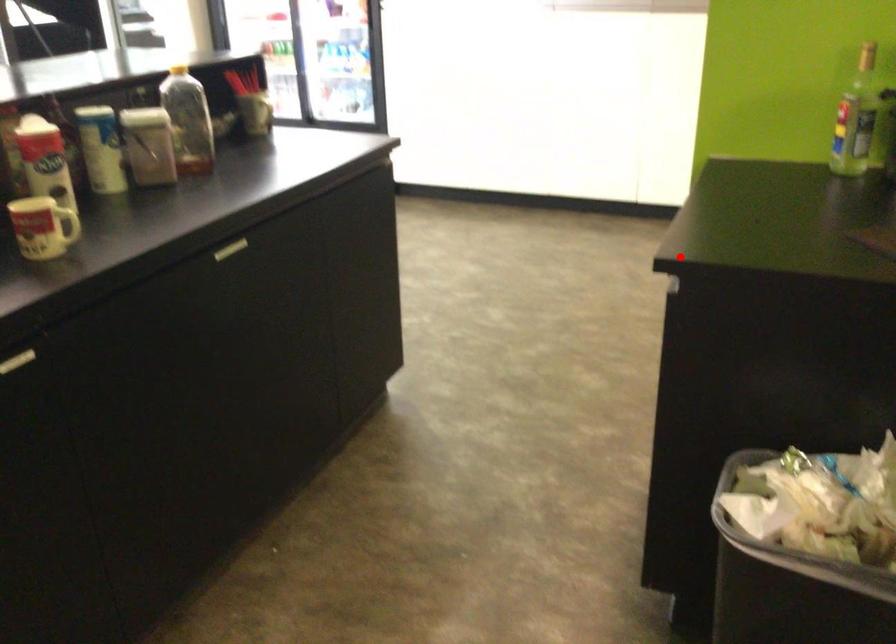
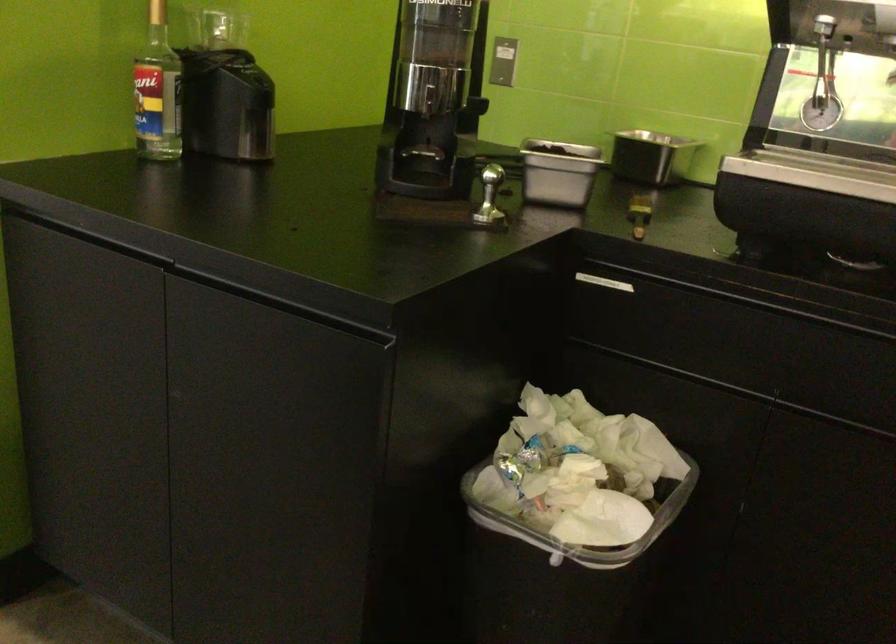
The point at the highlighted location is marked in the first image. Where is the corresponding point in the second image?

(280, 304)